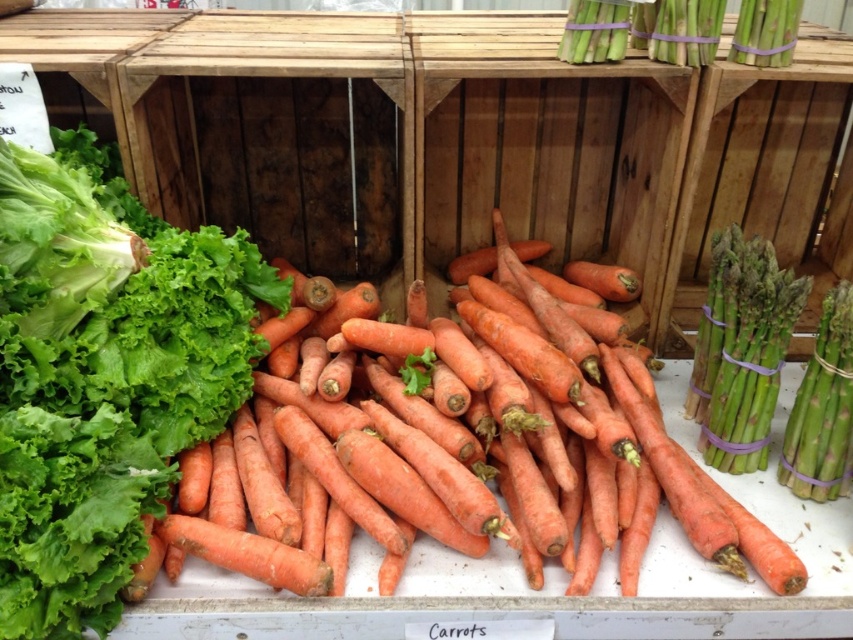
Does orange matte carrots at left appear under green matte asparagus at upper right?

Yes, orange matte carrots at left is below green matte asparagus at upper right.

Is point (54, 444) less distant than point (604, 32)?

Yes.

Is point (160, 225) farther from camera compared to point (740, 20)?

Yes, it is.

The image size is (853, 640). I want to click on orange matte carrots at left, so 105,384.

Can you confirm if orange matte carrots at center is thinner than green matte asparagus at upper right?

No.

At what (x,y) coordinates should I click in order to perform the action: click on orange matte carrots at center. Please return your answer as a coordinate pair (x, y). Looking at the image, I should click on (498, 444).

Where is `orange matte carrots at left`? The width and height of the screenshot is (853, 640). orange matte carrots at left is located at coordinates (105, 384).

Is orange matte carrots at left above orange matte carrots at center?

Yes.

Between point (190, 400) and point (738, 531), which one is positioned in front?

Point (738, 531) is in front.

What are the coordinates of `orange matte carrots at left` in the screenshot? It's located at (105, 384).